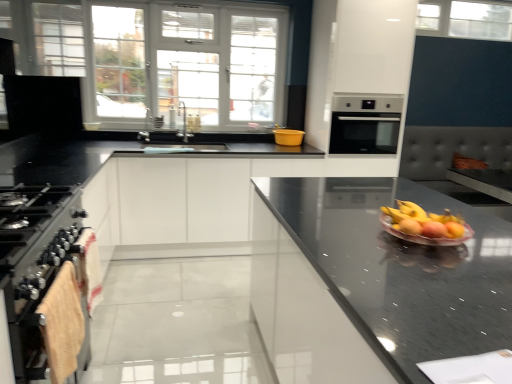
Question: Is black glossy countertop at center shorter than clear glass window at upper center, placed as the 2th window when sorted from left to right?

Choices:
 (A) no
 (B) yes

Answer: (A)

Question: From the image's perspective, is black glossy countertop at center located beneath clear glass window at upper center, marked as the 2th window in a bottom-to-top arrangement?

Choices:
 (A) no
 (B) yes

Answer: (B)

Question: Considering the relative sizes of black glossy countertop at center and clear glass window at upper center, placed as the 2th window when sorted from left to right, in the image provided, is black glossy countertop at center thinner than clear glass window at upper center, placed as the 2th window when sorted from left to right,?

Choices:
 (A) no
 (B) yes

Answer: (A)

Question: Is black glossy countertop at center with clear glass window at upper center, placed as the 2th window when sorted from left to right?

Choices:
 (A) no
 (B) yes

Answer: (A)

Question: Does black glossy countertop at center have a larger size compared to clear glass window at upper center, the first window positioned from the top?

Choices:
 (A) yes
 (B) no

Answer: (A)

Question: Can you confirm if black glossy countertop at center is positioned to the right of clear glass window at upper center, placed as the 2th window when sorted from left to right?

Choices:
 (A) yes
 (B) no

Answer: (B)

Question: Does stainless steel oven at left have a smaller size compared to shiny glass bowl of mixed fruits at center-right?

Choices:
 (A) no
 (B) yes

Answer: (A)

Question: Is stainless steel oven at left shorter than shiny glass bowl of mixed fruits at center-right?

Choices:
 (A) yes
 (B) no

Answer: (B)

Question: From a real-world perspective, does stainless steel oven at left sit lower than shiny glass bowl of mixed fruits at center-right?

Choices:
 (A) yes
 (B) no

Answer: (A)

Question: Considering the relative sizes of stainless steel oven at left and shiny glass bowl of mixed fruits at center-right in the image provided, is stainless steel oven at left bigger than shiny glass bowl of mixed fruits at center-right?

Choices:
 (A) no
 (B) yes

Answer: (B)

Question: Is stainless steel oven at left far from shiny glass bowl of mixed fruits at center-right?

Choices:
 (A) no
 (B) yes

Answer: (B)

Question: Is stainless steel oven at left taller than shiny glass bowl of mixed fruits at center-right?

Choices:
 (A) yes
 (B) no

Answer: (A)

Question: From the image's perspective, is satin silver oven at center above black glossy countertop at center?

Choices:
 (A) no
 (B) yes

Answer: (B)